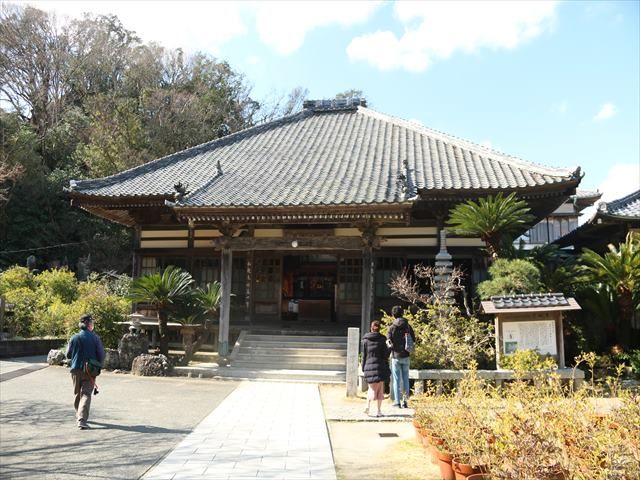
The image size is (640, 480). Find the location of `front door`. front door is located at coordinates (310, 300).